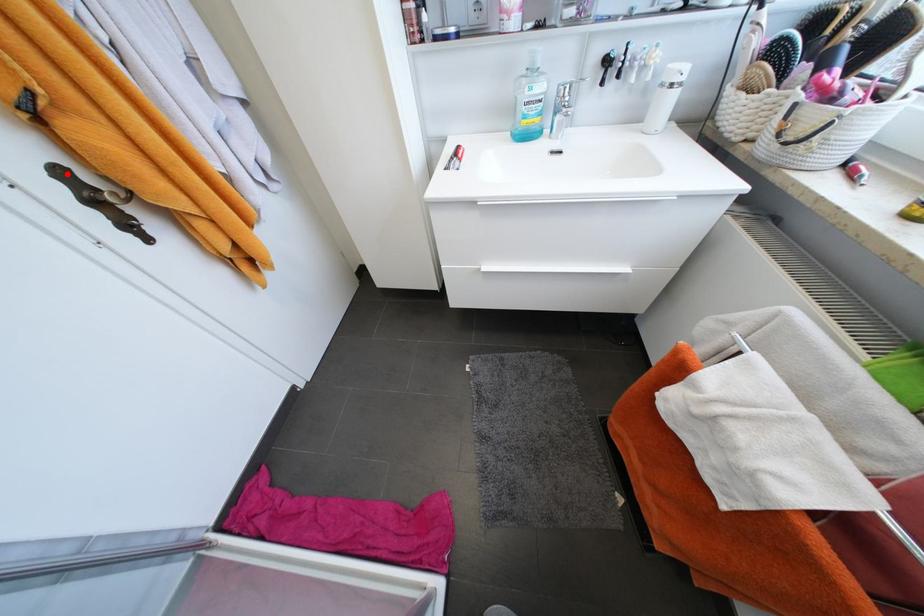
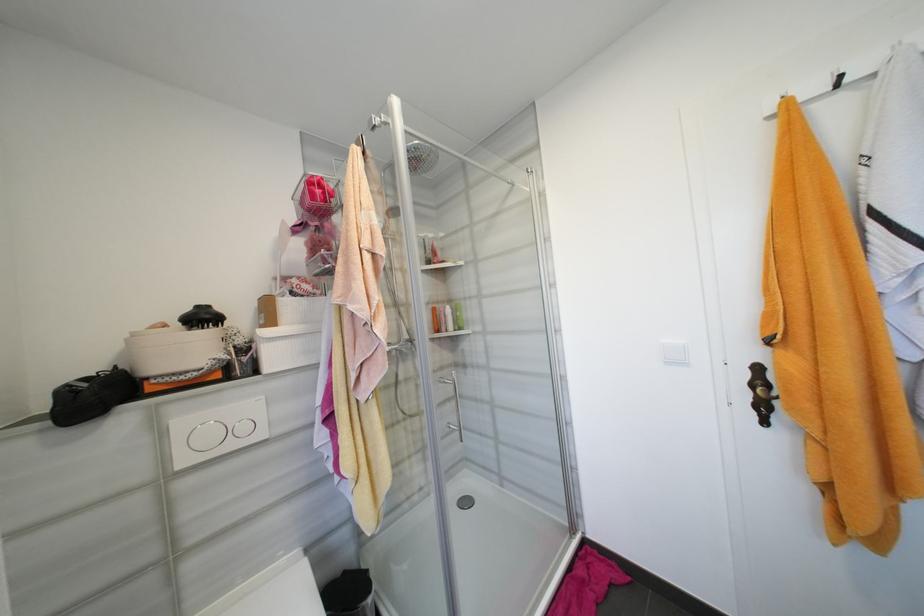
Question: I am providing you with two images of the same scene from different viewpoints. A red point is marked on the first image. Is the red point's position out of view in image 2?

Choices:
 (A) Yes
 (B) No

Answer: (B)